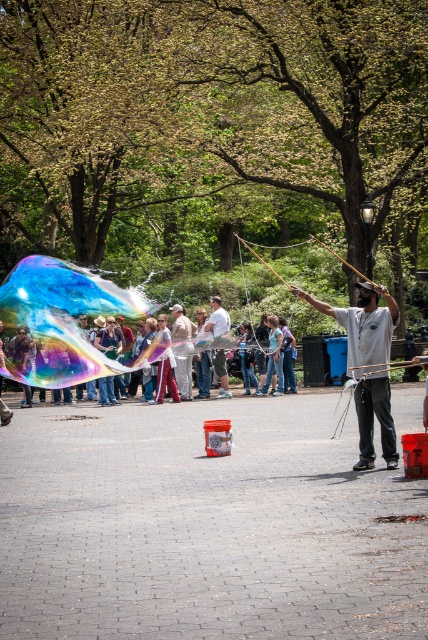
You are a photographer trying to capture the rainbow iridescent bubble at center and the matte white shirt at center in a single shot. Based on their sizes, which object would appear bigger in your photo?

The rainbow iridescent bubble at center appears bigger in the photo because its width is larger than the matte white shirt at center.

You are a photographer trying to capture the rainbow iridescent bubble at center and the matte white shirt at center in the same frame. Which object should you focus on first if you want to ensure both are in focus?

The rainbow iridescent bubble at center is positioned on the left side of matte white shirt at center, so you should focus on the matte white shirt at center first since it is closer to the camera and the bubble is further away, ensuring both are in focus.

You are standing at the center of the park and want to locate the rainbow iridescent bubble at center. According to the coordinates provided, in which direction should you move to find it?

The rainbow iridescent bubble at center is located at coordinates point (62, 317), which is slightly to the left and lower than the exact center of the park. Move slightly left and down from your current position at the center to find it.